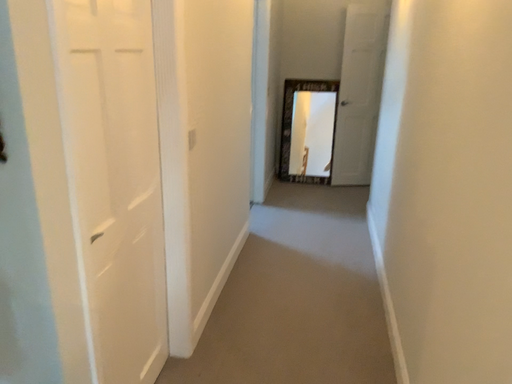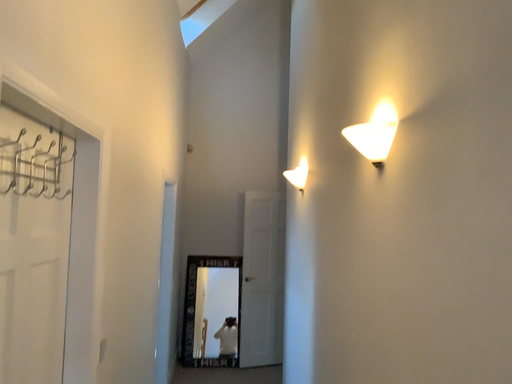
Question: How did the camera likely rotate when shooting the video?

Choices:
 (A) rotated upward
 (B) rotated downward

Answer: (A)